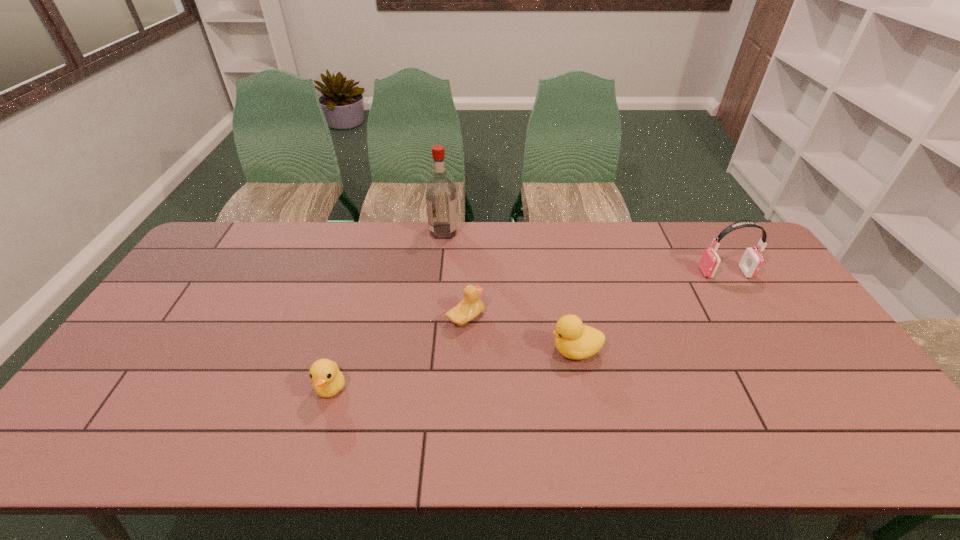
You are a GUI agent. You are given a task and a screenshot of the screen. Output one action in this format:
    pyautogui.click(x=<x>, y=<y>)
    Task: Click on the empty space between the nearest duck and the second duck from left to right
    The height and width of the screenshot is (540, 960).
    Given the screenshot: What is the action you would take?
    pyautogui.click(x=398, y=353)

Identify the location of vacant area that lies between the farthest object and the second farthest duck. The width and height of the screenshot is (960, 540). (510, 291).

Find the location of a particular element. blank region between the farthest duck and the second object from right to left is located at coordinates (520, 334).

The image size is (960, 540). Find the location of `unoccupied position between the rightmost duck and the fourth shortest object`. unoccupied position between the rightmost duck and the fourth shortest object is located at coordinates (650, 312).

Find the location of a particular element. vacant point located between the leftmost duck and the third nearest object is located at coordinates (398, 353).

The width and height of the screenshot is (960, 540). Identify the location of free space that is in between the farthest duck and the nearest object. (398, 353).

Identify which object is the second closest to the leftmost object. Please provide its 2D coordinates. Your answer should be formatted as a tuple, i.e. [(x, y)], where the tuple contains the x and y coordinates of a point satisfying the conditions above.

[(574, 340)]

Select which object is the second closest to the second farthest object. Please provide its 2D coordinates. Your answer should be formatted as a tuple, i.e. [(x, y)], where the tuple contains the x and y coordinates of a point satisfying the conditions above.

[(471, 306)]

Find the location of a particular element. duck that stands as the second closest to the farthest duck is located at coordinates (328, 380).

I want to click on the second closest duck to the leftmost object, so click(x=574, y=340).